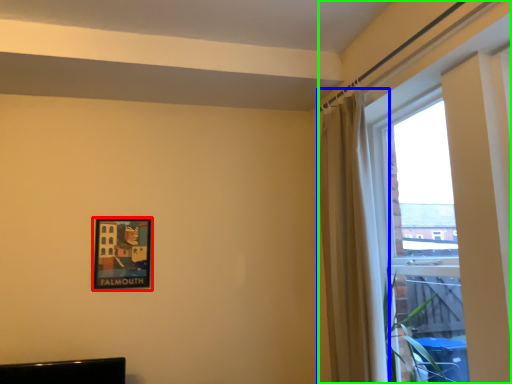
Question: Based on their relative distances, which object is nearer to picture frame (highlighted by a red box)? Choose from curtain (highlighted by a blue box) and window (highlighted by a green box).

Choices:
 (A) curtain
 (B) window

Answer: (A)